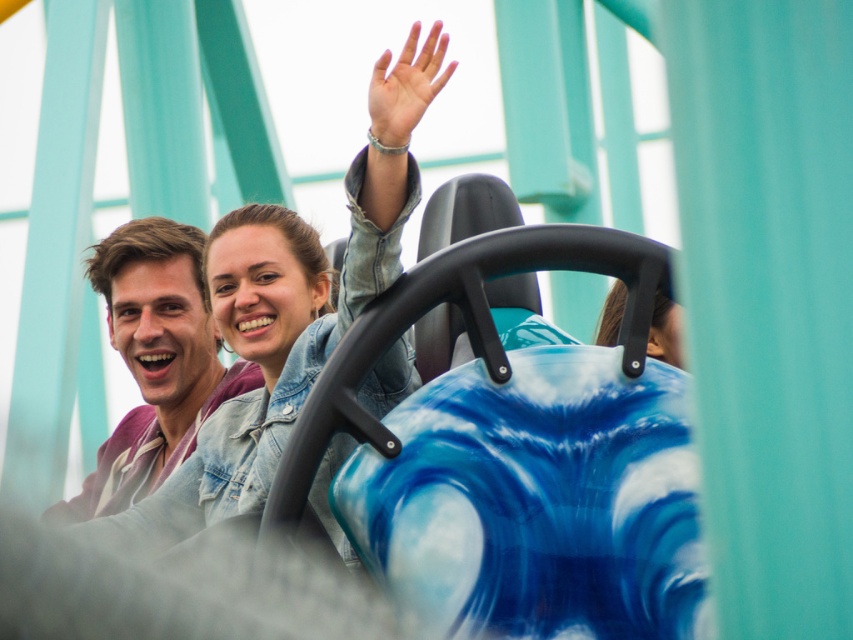
You are a photographer positioned at the base of the roller coaster. You need to capture a photo of both the denim jacket at upper center and the matte purple shirt at left. Based on their positions, which object should you focus on first to ensure both are in frame?

The denim jacket at upper center is above the matte purple shirt at left, so you should focus on the denim jacket at upper center first to ensure both are in frame.

You are standing at the entrance of the amusement park and see the denim jacket at upper center in the distance. If you want to take a photo of it, will you need a zoom lens to capture it clearly from your current position?

The denim jacket at upper center is 41.39 meters away from the viewer. Since this distance is quite far, using a zoom lens would be necessary to capture it clearly from your current position.

You are a photographer standing at the base of the roller coaster. You want to take a photo of the denim jacket at upper center and the matte purple shirt at left so that both are clearly visible. Based on their positions, which object should you focus on first to ensure both are in frame?

You should focus on the denim jacket at upper center first because it is positioned to the right of the matte purple shirt at left, so adjusting the camera to include both would require framing from the leftmost point of the matte purple shirt at left to the rightmost point of the denim jacket at upper center.